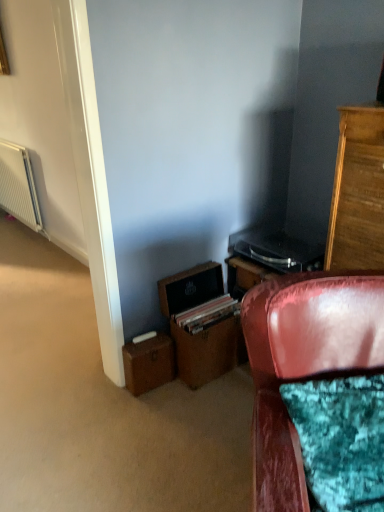
I want to click on free point in front of brown cardboard drawer at lower center, so click(x=210, y=399).